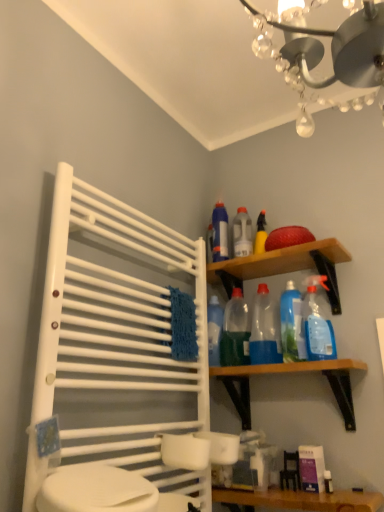
Locate an element on the screen. Image resolution: width=384 pixels, height=512 pixels. free space to the right of blue plastic spray bottle at upper right, which appears as the 1th cleaning product when viewed from the left is located at coordinates (248, 268).